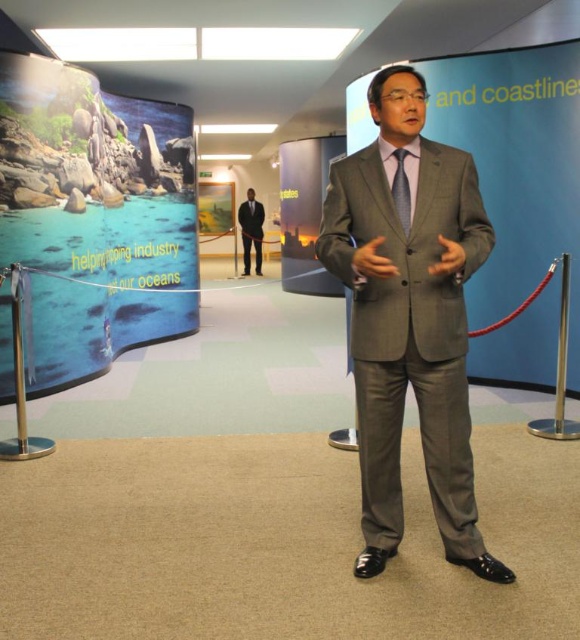
Question: Is the position of gray wool suit at center more distant than that of blue silk tie at center?

Choices:
 (A) no
 (B) yes

Answer: (A)

Question: Among these points, which one is farthest from the camera?

Choices:
 (A) (386, 144)
 (B) (252, 208)
 (C) (397, 195)
 (D) (259, 273)

Answer: (D)

Question: Which point is closer to the camera?

Choices:
 (A) black suit at center
 (B) dark gray silk tie at center

Answer: (B)

Question: Can you confirm if dark gray silk tie at center is positioned to the right of blue silk tie at center?

Choices:
 (A) no
 (B) yes

Answer: (B)

Question: From the image, what is the correct spatial relationship of black suit at center in relation to dark gray silk tie at center?

Choices:
 (A) below
 (B) above

Answer: (B)

Question: Among these objects, which one is nearest to the camera?

Choices:
 (A) blue silk tie at center
 (B) gray wool suit at center
 (C) dark gray silk tie at center
 (D) black suit at center

Answer: (B)